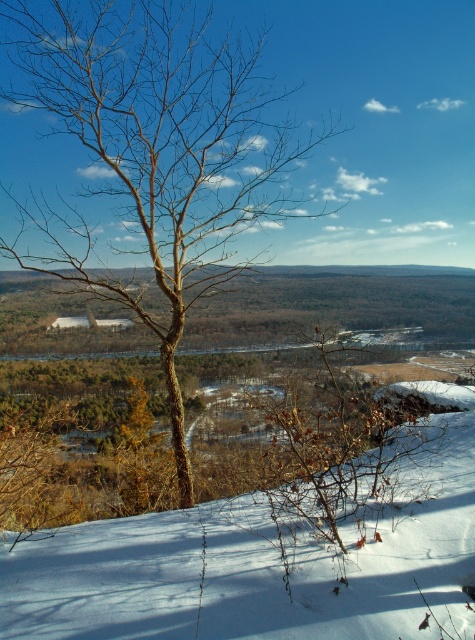
Question: Can you confirm if bare wood tree at center is smaller than white powdery snow at center?

Choices:
 (A) yes
 (B) no

Answer: (B)

Question: Which object is closer to the camera taking this photo?

Choices:
 (A) white powdery snow at center
 (B) bare wood tree at center

Answer: (A)

Question: Which of the following is the farthest from the observer?

Choices:
 (A) (152, 307)
 (B) (367, 547)

Answer: (A)

Question: Can you confirm if bare wood tree at center is wider than white powdery snow at center?

Choices:
 (A) no
 (B) yes

Answer: (A)

Question: Is bare wood tree at center further to the viewer compared to white powdery snow at center?

Choices:
 (A) yes
 (B) no

Answer: (A)